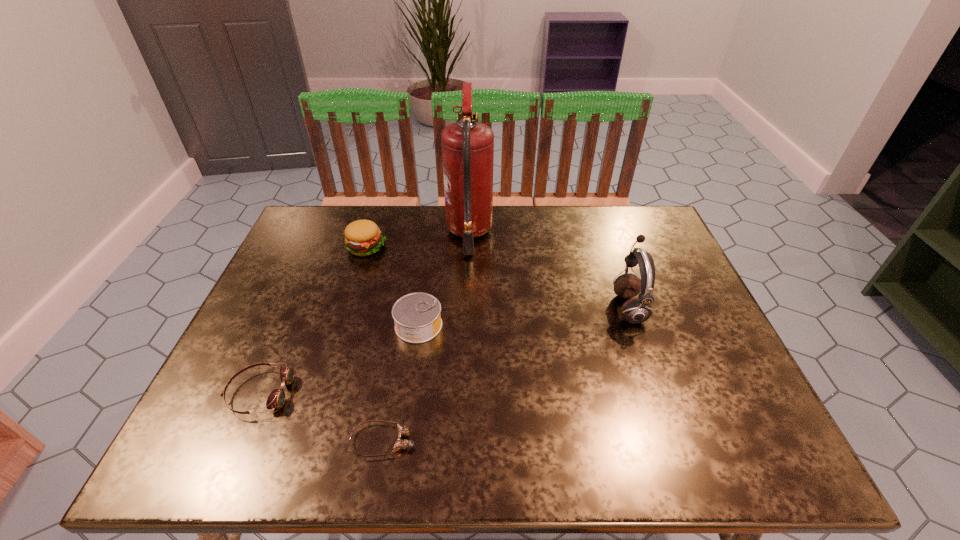
Find the location of a particular element. This screenshot has width=960, height=540. blank area located at the front of the tallest object where the nozzle is aimed is located at coordinates (538, 234).

Image resolution: width=960 pixels, height=540 pixels. I want to click on free space located 0.180m on the ear pads of the earphone, so click(543, 307).

The width and height of the screenshot is (960, 540). Identify the location of free space located on the ear pads of the earphone. pos(587,307).

This screenshot has height=540, width=960. Identify the location of vacant area located on the ear pads of the earphone. (516, 307).

Locate an element on the screen. This screenshot has height=540, width=960. free space located 0.290m on the right of the hamburger is located at coordinates (484, 247).

This screenshot has width=960, height=540. I want to click on free space located 0.310m on the back of the can, so click(x=431, y=235).

You are a GUI agent. You are given a task and a screenshot of the screen. Output one action in this format:
    pyautogui.click(x=<x>, y=<y>)
    Task: Click on the free space located 0.060m through the lenses of the second shortest object
    
    Given the screenshot: What is the action you would take?
    pyautogui.click(x=318, y=393)

This screenshot has width=960, height=540. I want to click on vacant space positioned on the front lenses and sides of the right goggles, so click(576, 441).

Where is `fire extinguisher that is positioned at the far edge`? fire extinguisher that is positioned at the far edge is located at coordinates (467, 146).

Locate an element on the screen. This screenshot has width=960, height=540. hamburger that is at the far edge is located at coordinates click(362, 237).